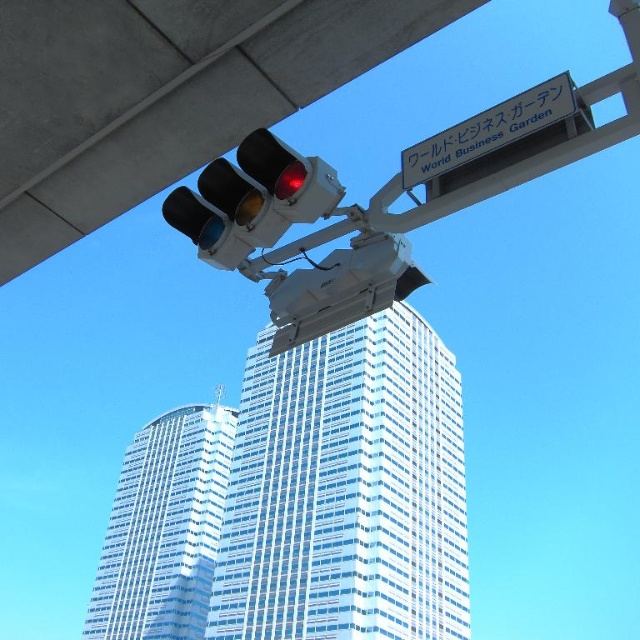
Question: Can you confirm if matte black traffic light at upper center is positioned to the left of white plastic sign at upper center?

Choices:
 (A) no
 (B) yes

Answer: (B)

Question: Is white concrete overpass at upper center behind matte black traffic light at upper center?

Choices:
 (A) no
 (B) yes

Answer: (B)

Question: Which point is farther from the camera taking this photo?

Choices:
 (A) (150, 515)
 (B) (301, 106)
 (C) (232, 630)

Answer: (A)

Question: Estimate the real-world distances between objects in this image. Which object is farther from the white plastic sign at upper center?

Choices:
 (A) white concrete overpass at upper center
 (B) matte black traffic light at upper center

Answer: (A)

Question: Can you confirm if white glass building at center is positioned to the right of matte black traffic light at upper center?

Choices:
 (A) yes
 (B) no

Answer: (A)

Question: Which object is the closest to the white glass building at lower left?

Choices:
 (A) white concrete overpass at upper center
 (B) white glass building at center
 (C) matte black traffic light at upper center

Answer: (B)